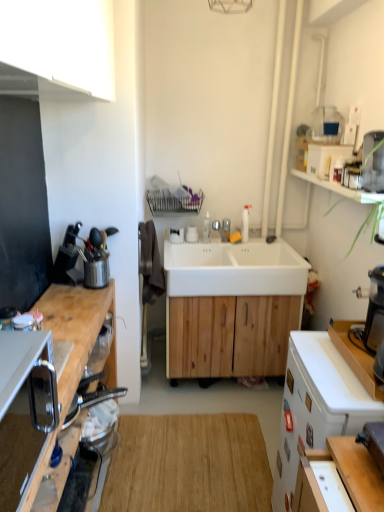
Locate an element on the screen. Image resolution: width=384 pixels, height=512 pixels. free region on the left part of white matte counter top at right is located at coordinates (331, 368).